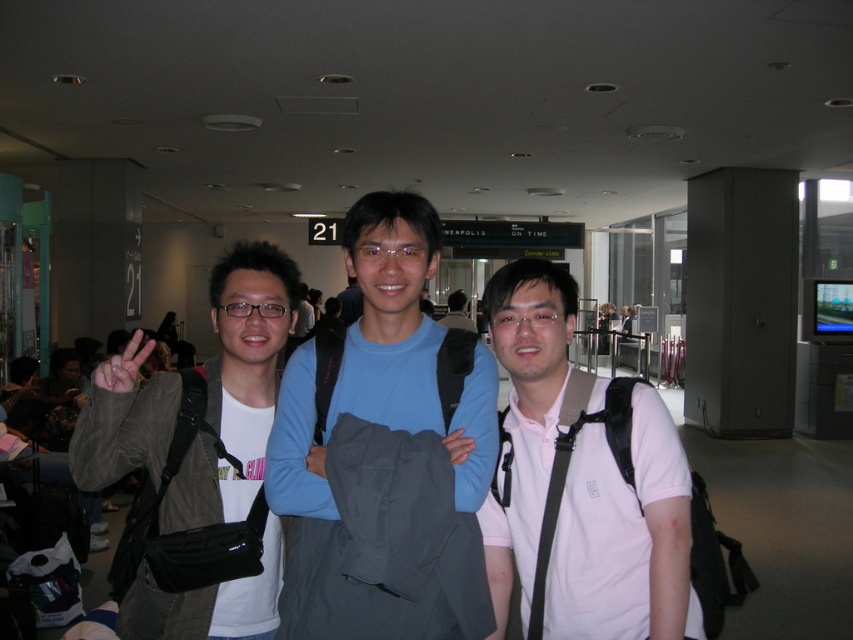
You are at the airport terminal and want to walk from point A to point B. Point A is located at coordinates point (315, 429) and point B is at point (235, 497). According to the image, which direction should you move to go from point A to point B?

To move from point A to point B, you should move backward since point A is in front of point B.

You are a photographer standing in the airport terminal. You see the blue cotton shirt at center and the matte black jacket at left. Which one is higher up in the image?

The blue cotton shirt at center is located above the matte black jacket at left, so it is higher up in the image.